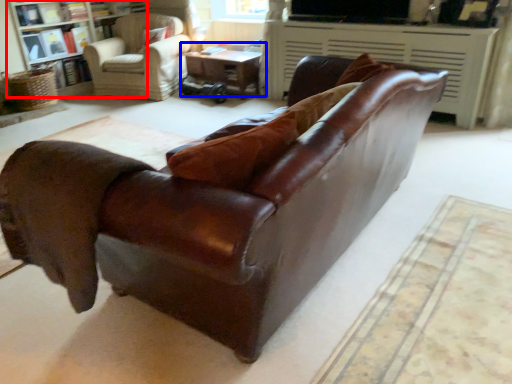
Question: Which of the following is the closest to the observer, bookcase (highlighted by a red box) or table (highlighted by a blue box)?

Choices:
 (A) bookcase
 (B) table

Answer: (A)